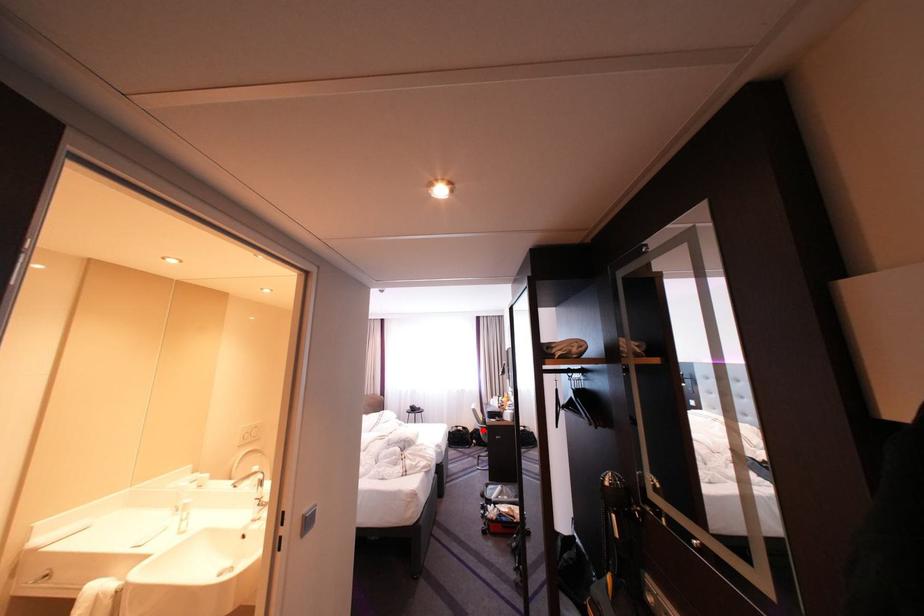
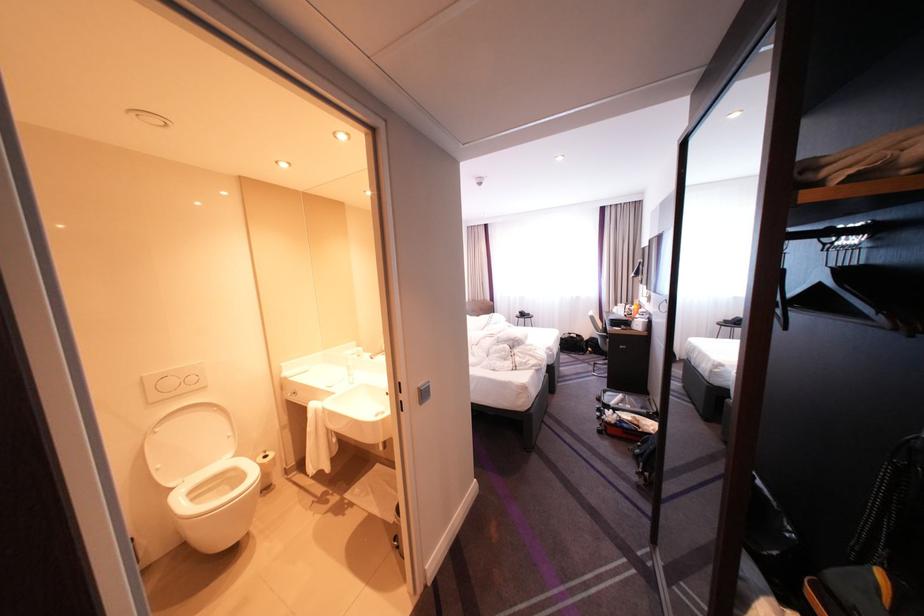
Question: I am providing you with two images of the same scene from different viewpoints. Image1 has a red point marked. In image2, the corresponding 3D location appears at what relative position? Reply with the corresponding letter.

Choices:
 (A) Closer
 (B) Farther

Answer: (A)